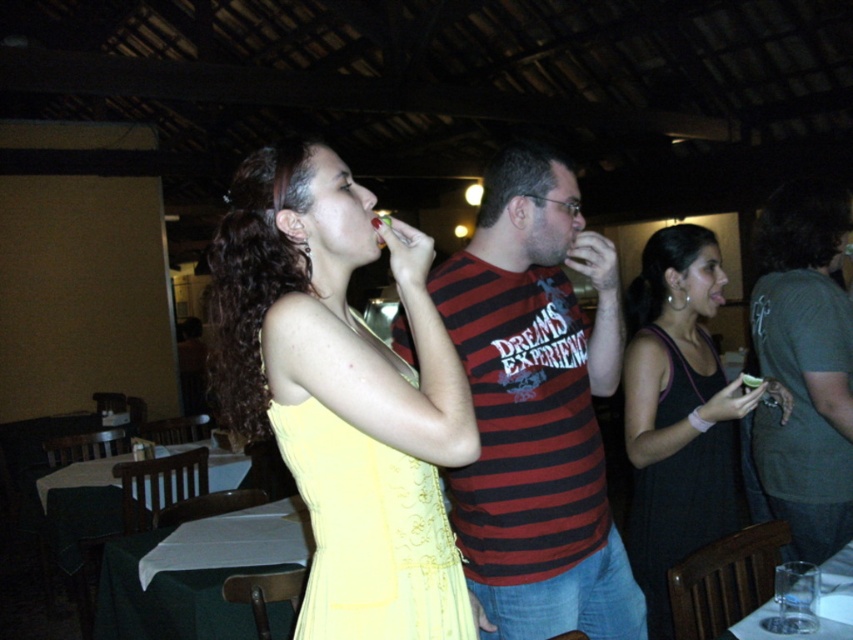
You are a fashion designer observing two dresses in the center of the image. Which one has a wider silhouette? The yellow fabric dress at center or the yellow satin dress at center?

The yellow fabric dress at center is wider than the yellow satin dress at center according to the description.

Based on the photo, you are a photographer standing at the back of the room. You want to take a photo of both the yellow fabric dress at center and the yellow satin dress at center. Can you fit both dresses in your camera frame if your camera has a maximum width of 6 inches?

The distance between the yellow fabric dress at center and the yellow satin dress at center is 5.87 inches, which is less than the camera frame width of 6 inches. Therefore, both dresses can be captured in a single frame.